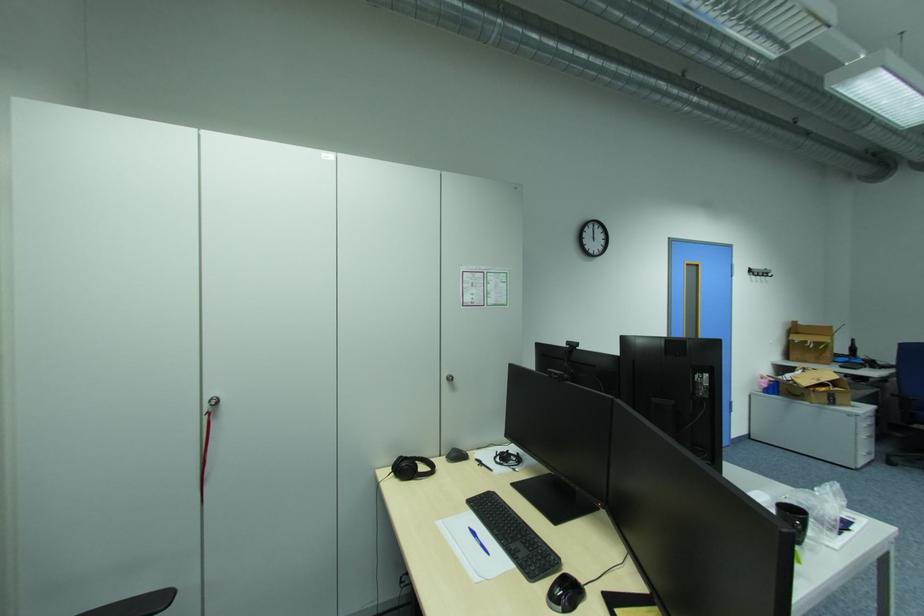
The location [794,519] corresponds to which object?

This point indicates the black ceramic cup.